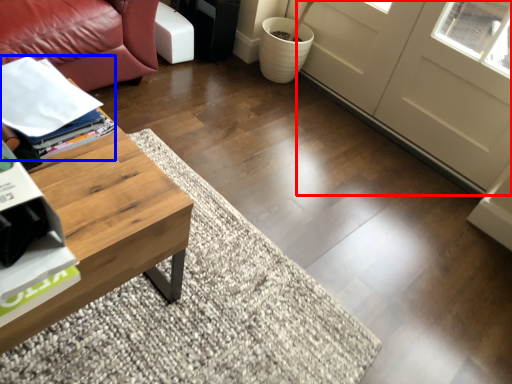
Question: Which of the following is the closest to the observer, screen door (highlighted by a red box) or magazine (highlighted by a blue box)?

Choices:
 (A) screen door
 (B) magazine

Answer: (B)